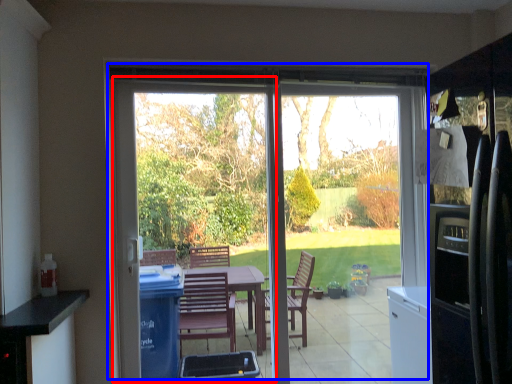
Question: Among these objects, which one is nearest to the camera, screen door (highlighted by a red box) or door (highlighted by a blue box)?

Choices:
 (A) screen door
 (B) door

Answer: (A)